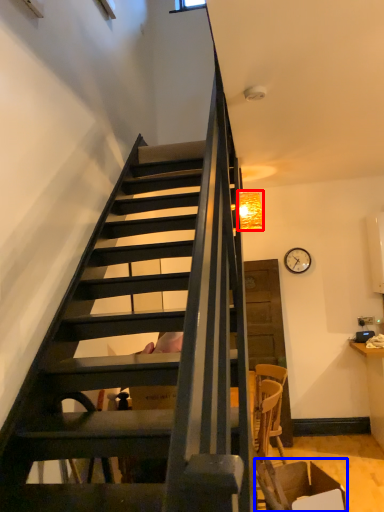
Question: Which object appears closest to the camera in this image, lamp (highlighted by a red box) or armchair (highlighted by a blue box)?

Choices:
 (A) lamp
 (B) armchair

Answer: (B)